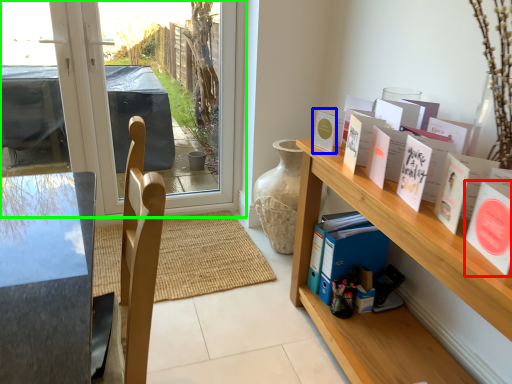
Question: Considering the real-world distances, which object is closest to book (highlighted by a red box)? book (highlighted by a blue box) or window (highlighted by a green box).

Choices:
 (A) book
 (B) window

Answer: (A)